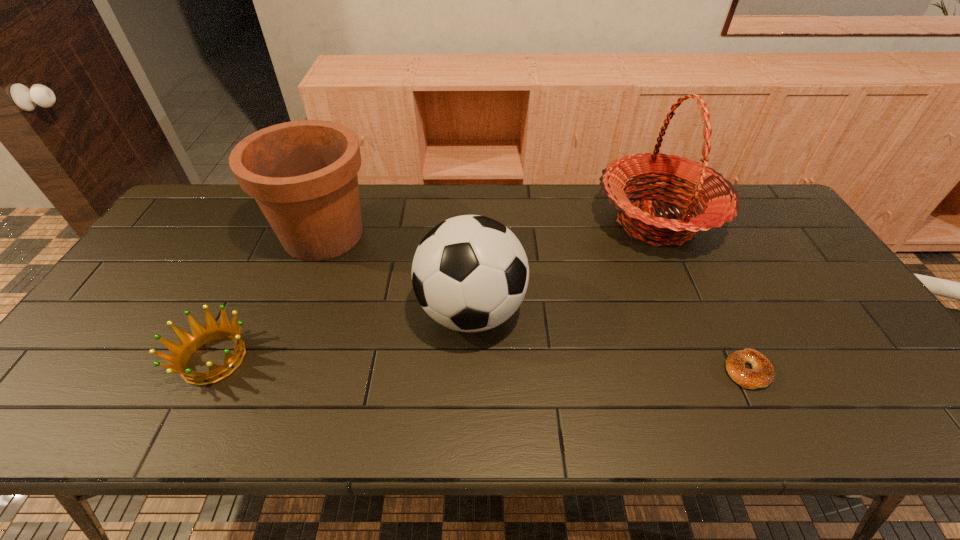
This screenshot has height=540, width=960. Find the location of `basket located at the far edge`. basket located at the far edge is located at coordinates (720, 200).

I want to click on flowerpot that is at the far edge, so click(x=303, y=174).

This screenshot has height=540, width=960. What are the coordinates of `free location at the far edge` in the screenshot? It's located at (367, 219).

Where is `free region at the near edge`? The height and width of the screenshot is (540, 960). free region at the near edge is located at coordinates (308, 421).

Where is `free space at the left edge of the desktop`? This screenshot has height=540, width=960. free space at the left edge of the desktop is located at coordinates (90, 361).

What are the coordinates of `vacant space that's between the crown and the flowerpot` in the screenshot? It's located at (269, 297).

Locate an element on the screen. vacant space that's between the third object from right to left and the tallest object is located at coordinates (564, 267).

Identify the location of free spot between the soccer ball and the shortest object. (610, 341).

Locate an element on the screen. This screenshot has width=960, height=540. free space that is in between the tallest object and the bagel is located at coordinates (702, 296).

Find the location of `empty space that is in between the shortest object and the third object from left to right`. empty space that is in between the shortest object and the third object from left to right is located at coordinates (610, 341).